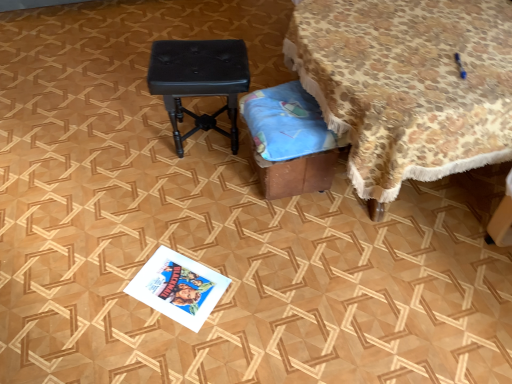
Locate an element on the screen. black leather stool at center is located at coordinates (199, 81).

Image resolution: width=512 pixels, height=384 pixels. Identify the location of brown cardboard box at lower center. (290, 140).

This screenshot has width=512, height=384. Describe the element at coordinates (290, 140) in the screenshot. I see `brown cardboard box at lower center` at that location.

Identify the location of white glossy magazine at lower center. click(178, 287).

Which is behind, point (168, 77) or point (316, 170)?

The point (168, 77) is behind.

In terms of width, does black leather stool at center look wider or thinner when compared to brown cardboard box at lower center?

Clearly, black leather stool at center has more width compared to brown cardboard box at lower center.

From a real-world perspective, who is located lower, black leather stool at center or brown cardboard box at lower center?

brown cardboard box at lower center.

Visually, is white glossy magazine at lower center positioned to the left or to the right of floral fabric-covered table at upper right?

From the image, it's evident that white glossy magazine at lower center is to the left of floral fabric-covered table at upper right.

From a real-world perspective, which is physically below, white glossy magazine at lower center or floral fabric-covered table at upper right?

white glossy magazine at lower center is physically lower.

This screenshot has width=512, height=384. I want to click on table that appears on the right of white glossy magazine at lower center, so click(x=408, y=85).

Consider the image. From the image's perspective, which is above, white glossy magazine at lower center or floral fabric-covered table at upper right?

floral fabric-covered table at upper right.

Looking at this image, is floral fabric-covered table at upper right next to black leather stool at center and touching it?

No, floral fabric-covered table at upper right is not beside black leather stool at center.

Considering the sizes of floral fabric-covered table at upper right and black leather stool at center in the image, is floral fabric-covered table at upper right wider or thinner than black leather stool at center?

Clearly, floral fabric-covered table at upper right has more width compared to black leather stool at center.

Could you tell me if floral fabric-covered table at upper right is facing black leather stool at center?

Yes, floral fabric-covered table at upper right is aimed at black leather stool at center.

Is point (448, 62) positioned before point (276, 157)?

Yes.

Would you say floral fabric-covered table at upper right is outside brown cardboard box at lower center?

Indeed, floral fabric-covered table at upper right is completely outside brown cardboard box at lower center.

Does floral fabric-covered table at upper right have a greater width compared to brown cardboard box at lower center?

Correct, the width of floral fabric-covered table at upper right exceeds that of brown cardboard box at lower center.

From a real-world perspective, is floral fabric-covered table at upper right below brown cardboard box at lower center?

No, from a real-world perspective, floral fabric-covered table at upper right is not under brown cardboard box at lower center.

From the image's perspective, which object appears higher, brown cardboard box at lower center or black leather stool at center?

black leather stool at center is shown above in the image.

Which of these two, brown cardboard box at lower center or black leather stool at center, is wider?

black leather stool at center.

From a real-world perspective, is brown cardboard box at lower center below black leather stool at center?

Yes, from a real-world perspective, brown cardboard box at lower center is beneath black leather stool at center.

Can you confirm if brown cardboard box at lower center is bigger than black leather stool at center?

Actually, brown cardboard box at lower center might be smaller than black leather stool at center.

In the scene shown: From a real-world perspective, who is located lower, brown cardboard box at lower center or floral fabric-covered table at upper right?

In real-world perspective, brown cardboard box at lower center is lower.

This screenshot has width=512, height=384. What are the coordinates of `furniture below the floral fabric-covered table at upper right (from a real-world perspective)` in the screenshot? It's located at (290, 140).

Which of these two, brown cardboard box at lower center or floral fabric-covered table at upper right, is thinner?

Thinner between the two is brown cardboard box at lower center.

Is brown cardboard box at lower center closer to camera compared to floral fabric-covered table at upper right?

No, brown cardboard box at lower center is further to the viewer.

From the image's perspective, is brown cardboard box at lower center beneath white glossy magazine at lower center?

No.

Does brown cardboard box at lower center have a greater height compared to white glossy magazine at lower center?

Yes.

Could you tell me if brown cardboard box at lower center is facing white glossy magazine at lower center?

No.

Considering the sizes of objects brown cardboard box at lower center and white glossy magazine at lower center in the image provided, who is wider, brown cardboard box at lower center or white glossy magazine at lower center?

brown cardboard box at lower center.

I want to click on furniture in front of the black leather stool at center, so 290,140.

Locate an element on the screen. magazine below the floral fabric-covered table at upper right (from the image's perspective) is located at coordinates (178, 287).

Looking at this image, from the image, which object appears to be farther from black leather stool at center, brown cardboard box at lower center or floral fabric-covered table at upper right?

floral fabric-covered table at upper right.

When comparing their distances from brown cardboard box at lower center, does floral fabric-covered table at upper right or white glossy magazine at lower center seem closer?

floral fabric-covered table at upper right is closer to brown cardboard box at lower center.

Looking at the image, which one is located closer to black leather stool at center, floral fabric-covered table at upper right or white glossy magazine at lower center?

floral fabric-covered table at upper right is closer to black leather stool at center.

Based on their spatial positions, is floral fabric-covered table at upper right or brown cardboard box at lower center closer to white glossy magazine at lower center?

The object closer to white glossy magazine at lower center is brown cardboard box at lower center.

Consider the image. Looking at the image, which one is located further to floral fabric-covered table at upper right, black leather stool at center or brown cardboard box at lower center?

black leather stool at center.

Estimate the real-world distances between objects in this image. Which object is closer to black leather stool at center, white glossy magazine at lower center or floral fabric-covered table at upper right?

floral fabric-covered table at upper right lies closer to black leather stool at center than the other object.

Considering their positions, is brown cardboard box at lower center positioned closer to white glossy magazine at lower center than floral fabric-covered table at upper right?

brown cardboard box at lower center.

Which object lies nearer to the anchor point brown cardboard box at lower center, black leather stool at center or white glossy magazine at lower center?

black leather stool at center.

Locate an element on the screen. The height and width of the screenshot is (384, 512). stool between white glossy magazine at lower center and floral fabric-covered table at upper right in the horizontal direction is located at coordinates (199, 81).

Find the location of a particular element. furniture situated between white glossy magazine at lower center and floral fabric-covered table at upper right from left to right is located at coordinates (290, 140).

Locate an element on the screen. furniture between black leather stool at center and floral fabric-covered table at upper right in the horizontal direction is located at coordinates click(290, 140).

Locate an element on the screen. The width and height of the screenshot is (512, 384). furniture between black leather stool at center and white glossy magazine at lower center vertically is located at coordinates (290, 140).